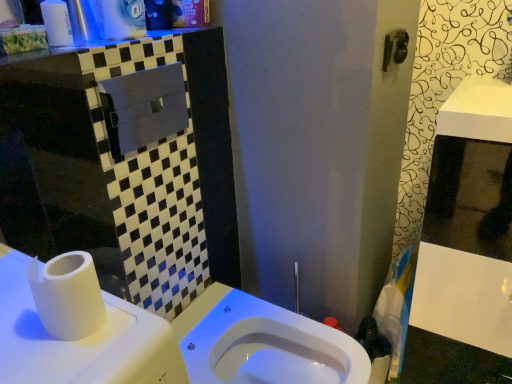
Question: From a real-world perspective, is white plastic cup at upper left located higher than white glossy counter top at upper left?

Choices:
 (A) no
 (B) yes

Answer: (B)

Question: Is white plastic cup at upper left bigger than white glossy counter top at upper left?

Choices:
 (A) no
 (B) yes

Answer: (A)

Question: Is white plastic cup at upper left facing away from white glossy counter top at upper left?

Choices:
 (A) no
 (B) yes

Answer: (A)

Question: Is white plastic cup at upper left behind white glossy counter top at upper left?

Choices:
 (A) no
 (B) yes

Answer: (B)

Question: Is there a large distance between white plastic cup at upper left and white glossy counter top at upper left?

Choices:
 (A) yes
 (B) no

Answer: (B)

Question: In terms of width, does white glossy medicine cabinet at right look wider or thinner when compared to white glossy toilet at center?

Choices:
 (A) thin
 (B) wide

Answer: (A)

Question: Based on their positions, is white glossy medicine cabinet at right located to the left or right of white glossy toilet at center?

Choices:
 (A) left
 (B) right

Answer: (B)

Question: From their relative heights in the image, would you say white glossy medicine cabinet at right is taller or shorter than white glossy toilet at center?

Choices:
 (A) tall
 (B) short

Answer: (A)

Question: Is white glossy medicine cabinet at right bigger or smaller than white glossy toilet at center?

Choices:
 (A) big
 (B) small

Answer: (A)

Question: Is white plastic cup at upper left situated inside white matte toilet paper at left or outside?

Choices:
 (A) inside
 (B) outside

Answer: (B)

Question: Considering the positions of point (56, 16) and point (87, 314), is point (56, 16) closer or farther from the camera than point (87, 314)?

Choices:
 (A) closer
 (B) farther

Answer: (B)

Question: From their relative heights in the image, would you say white plastic cup at upper left is taller or shorter than white matte toilet paper at left?

Choices:
 (A) short
 (B) tall

Answer: (B)

Question: In terms of size, does white plastic cup at upper left appear bigger or smaller than white matte toilet paper at left?

Choices:
 (A) small
 (B) big

Answer: (A)

Question: Based on their sizes in the image, would you say white glossy counter top at upper left is bigger or smaller than white plastic cup at upper left?

Choices:
 (A) small
 (B) big

Answer: (B)

Question: From a real-world perspective, is white glossy counter top at upper left positioned above or below white plastic cup at upper left?

Choices:
 (A) below
 (B) above

Answer: (A)